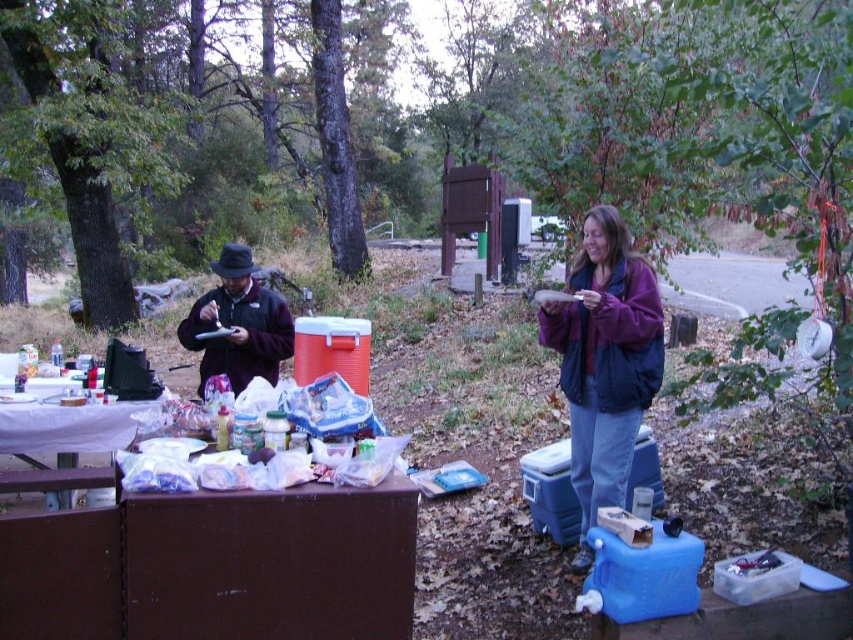
Which is below, purple fleece jacket at upper right or brown wood picnic table at lower left?

Positioned lower is brown wood picnic table at lower left.

Is point (576, 420) in front of point (102, 422)?

Yes.

Image resolution: width=853 pixels, height=640 pixels. What are the coordinates of `purple fleece jacket at upper right` in the screenshot? It's located at point(604,362).

Which is more to the left, translucent plastic bags at center or brown wood picnic table at lower left?

From the viewer's perspective, brown wood picnic table at lower left appears more on the left side.

Is point (366, 419) less distant than point (26, 397)?

Yes, it is in front of point (26, 397).

In order to click on translucent plastic bags at center in this screenshot , I will do `click(210, 472)`.

Does matte black jacket at left lie in front of brown wood picnic table at lower left?

No, matte black jacket at left is behind brown wood picnic table at lower left.

Does point (241, 275) come farther from viewer compared to point (9, 369)?

No, (241, 275) is closer to viewer.

This screenshot has width=853, height=640. Find the location of `matte black jacket at left`. matte black jacket at left is located at coordinates (238, 323).